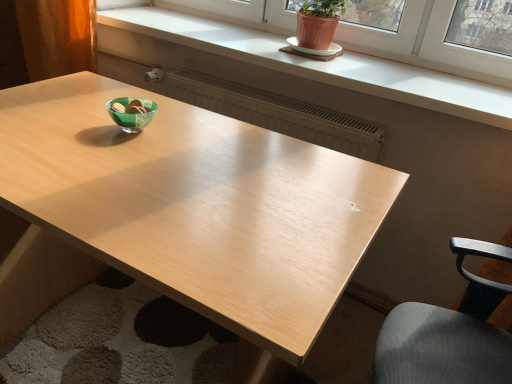
Question: Considering the relative sizes of matte white window sill at upper center and light wood table at center in the image provided, is matte white window sill at upper center bigger than light wood table at center?

Choices:
 (A) yes
 (B) no

Answer: (B)

Question: Is matte white window sill at upper center closer to camera compared to light wood table at center?

Choices:
 (A) yes
 (B) no

Answer: (B)

Question: Are matte white window sill at upper center and light wood table at center far apart?

Choices:
 (A) no
 (B) yes

Answer: (B)

Question: From the image's perspective, is matte white window sill at upper center on top of light wood table at center?

Choices:
 (A) no
 (B) yes

Answer: (B)

Question: Is matte white window sill at upper center positioned with its back to light wood table at center?

Choices:
 (A) yes
 (B) no

Answer: (B)

Question: Based on their sizes in the image, would you say matte white window sill at upper center is bigger or smaller than matte brown curtain at left?

Choices:
 (A) small
 (B) big

Answer: (B)

Question: Considering their positions, is matte white window sill at upper center located in front of or behind matte brown curtain at left?

Choices:
 (A) front
 (B) behind

Answer: (A)

Question: From the image's perspective, is matte white window sill at upper center located above or below matte brown curtain at left?

Choices:
 (A) above
 (B) below

Answer: (B)

Question: Is matte white window sill at upper center wider or thinner than matte brown curtain at left?

Choices:
 (A) wide
 (B) thin

Answer: (A)

Question: From their relative heights in the image, would you say matte brown curtain at left is taller or shorter than white ceramic saucer at upper center?

Choices:
 (A) short
 (B) tall

Answer: (B)

Question: Considering the relative positions of matte brown curtain at left and white ceramic saucer at upper center in the image provided, is matte brown curtain at left to the left or to the right of white ceramic saucer at upper center?

Choices:
 (A) left
 (B) right

Answer: (A)

Question: Is matte brown curtain at left spatially inside white ceramic saucer at upper center, or outside of it?

Choices:
 (A) inside
 (B) outside

Answer: (B)

Question: Is matte brown curtain at left in front of or behind white ceramic saucer at upper center in the image?

Choices:
 (A) front
 (B) behind

Answer: (B)

Question: Based on their sizes in the image, would you say matte white window sill at upper center is bigger or smaller than white ceramic saucer at upper center?

Choices:
 (A) small
 (B) big

Answer: (B)

Question: In the image, is matte white window sill at upper center positioned in front of or behind white ceramic saucer at upper center?

Choices:
 (A) behind
 (B) front

Answer: (B)